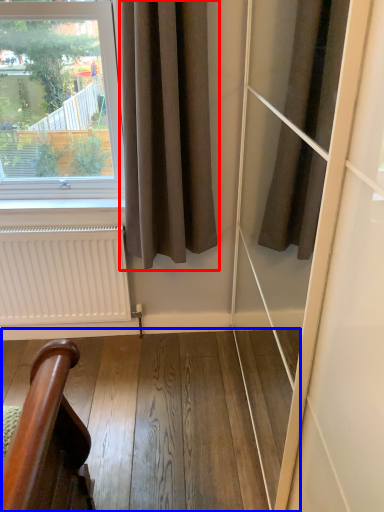
Question: Among these objects, which one is farthest to the camera, curtain (highlighted by a red box) or stairwell (highlighted by a blue box)?

Choices:
 (A) curtain
 (B) stairwell

Answer: (B)